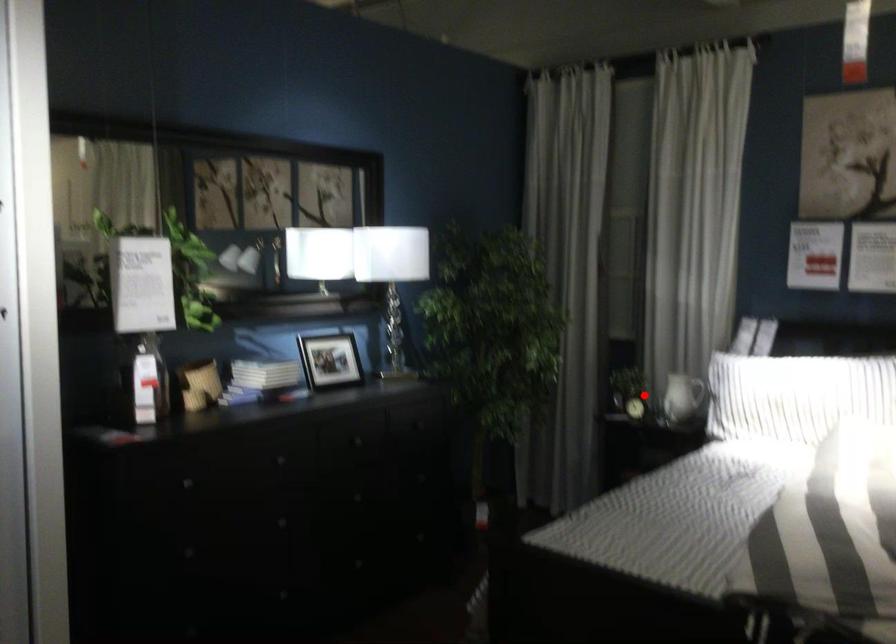
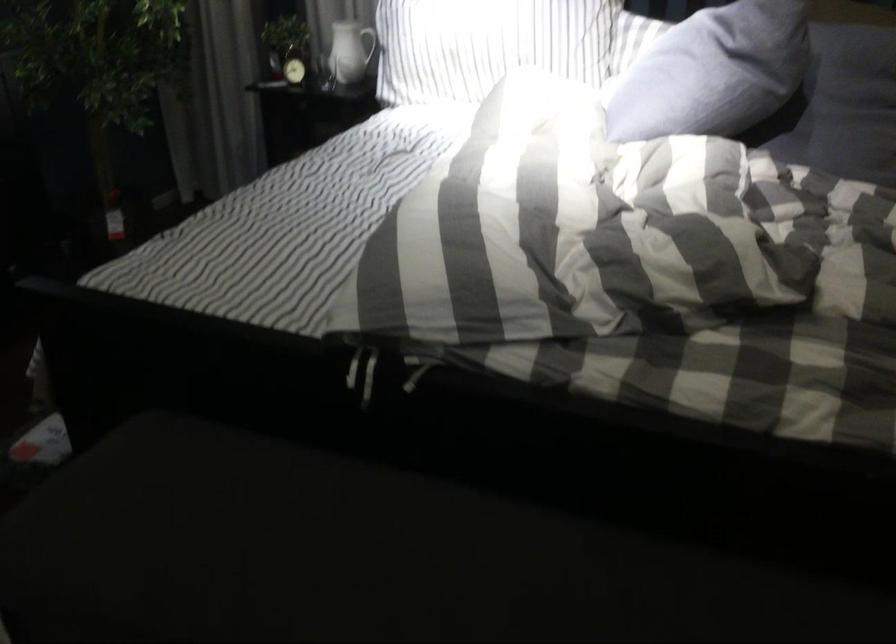
Question: I am providing you with two images of the same scene from different viewpoints. In image1, a red point is highlighted. Considering the same 3D point in image2, which of the following is correct?

Choices:
 (A) It is closer
 (B) It is farther

Answer: (A)